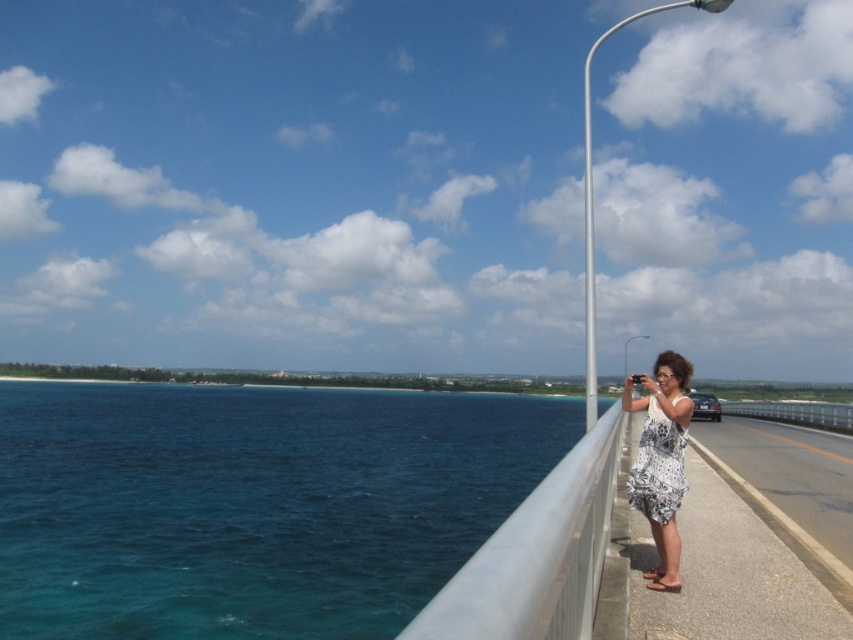
You are standing on the bridge and want to take a photo of the blue water at left. Where should you position your camera to capture it?

The blue water at left is located at coordinates (x=252, y=504), so position your camera there to capture it.

You are a photographer standing on the bridge and want to capture both the blue water at left and the metallic silver pole at upper center in your photo. Which object will occupy more of the frame?

The blue water at left is larger in size than the metallic silver pole at upper center, so it will occupy more of the frame.

You are standing on the bridge and want to take a photo of the blue water at left. Where should you position yourself to capture it in the frame?

To capture the blue water at left in your photo, position yourself near the bridge edge facing the direction of the blue water at left, as its 2D location is at point [252,504].